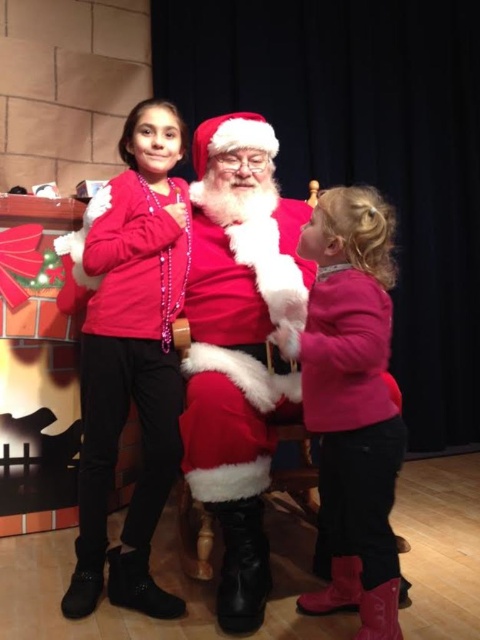
Between point (110, 320) and point (180, 428), which one is positioned behind?

The point (180, 428) is more distant.

Is matte red sweater at left in front of velvet red santa suit at center?

No, matte red sweater at left is behind velvet red santa suit at center.

Which is in front, point (153, 204) or point (247, 440)?

Point (247, 440) is in front.

Image resolution: width=480 pixels, height=640 pixels. Identify the location of matte red sweater at left. (132, 358).

Is point (261, 166) positioned after point (374, 248)?

Yes, point (261, 166) is behind point (374, 248).

Does fuzzy red santa at center have a greater width compared to pink fuzzy sweater at right?

Yes.

Does point (232, 250) lie in front of point (368, 556)?

No, (232, 250) is further to viewer.

Locate an element on the screen. fuzzy red santa at center is located at coordinates (239, 344).

Between fuzzy red santa at center and matte red sweater at left, which one appears on the right side from the viewer's perspective?

fuzzy red santa at center is more to the right.

Can you confirm if fuzzy red santa at center is thinner than matte red sweater at left?

No.

The height and width of the screenshot is (640, 480). What are the coordinates of `fuzzy red santa at center` in the screenshot? It's located at (239, 344).

Find the location of a particular element. The height and width of the screenshot is (640, 480). fuzzy red santa at center is located at coordinates (239, 344).